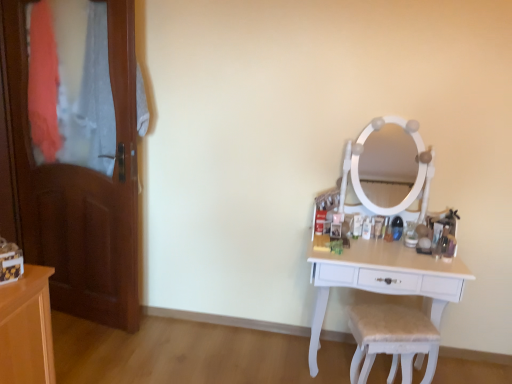
Identify the location of unoccupied area in front of wooden door at left. This screenshot has height=384, width=512. (81, 342).